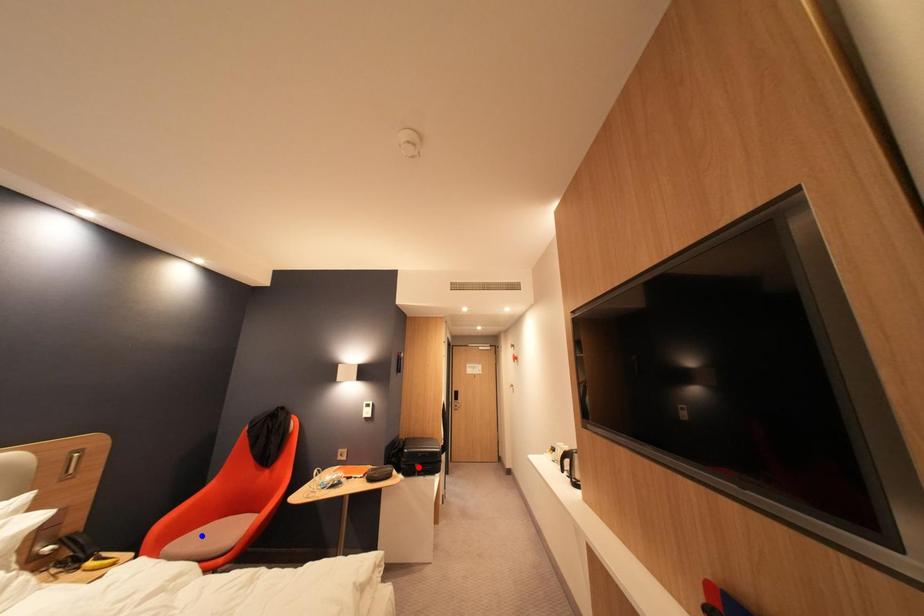
Question: In the image, two points are highlighted. Which point is nearer to the camera? Reply with the corresponding letter.

Choices:
 (A) blue point
 (B) red point

Answer: (A)